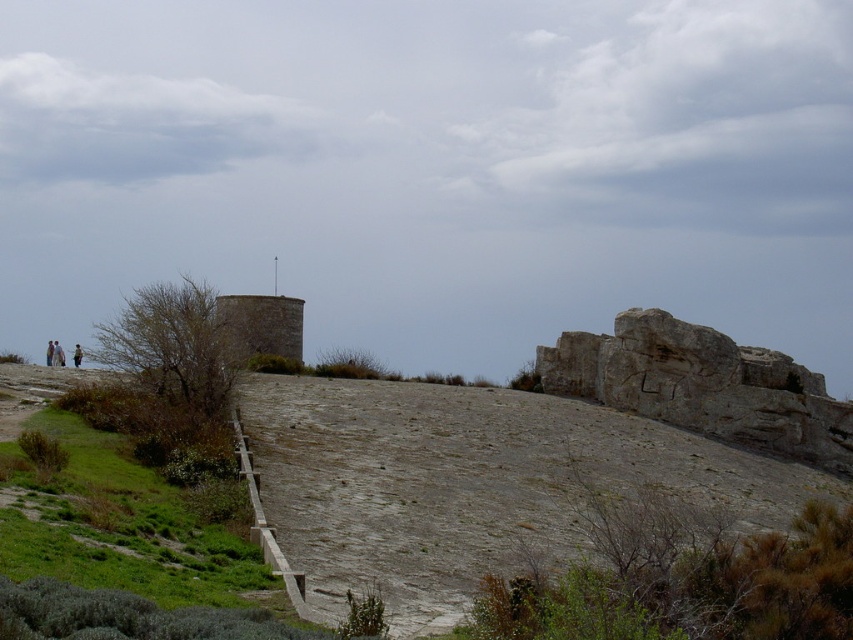
Consider the image. You are standing at the green grassy at lower left and want to reach the gray rocky hillside at center. Which direction should you move to get there?

You should move to the right to reach the gray rocky hillside at center from the green grassy at lower left, as the gray rocky hillside at center is located to the right of the green grassy at lower left.

You are a hiker with a 20 meter rope. You need to cross from the gray rocky hillside at center to the green grassy at lower left. Can you safely use your rope to make the crossing?

The distance between the gray rocky hillside at center and the green grassy at lower left is 18.65 meters, which is less than the 20 meter length of your rope. Therefore, you can safely use your rope to cross.

You are planning to set up a temporary campsite in this area. You need to choose between the gray rocky hillside at center and the green grassy at lower left. Which location offers a wider area for setting up tents?

The gray rocky hillside at center offers a wider area for setting up tents because its width is larger than the green grassy at lower left.